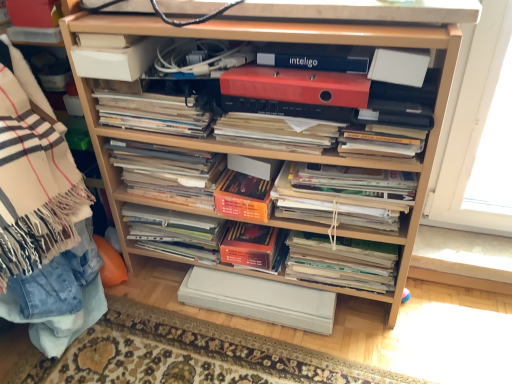
Locate an element on the screen. free region on the left part of blue matte inteligo at upper center, which appears as the second paperback book when viewed from the top is located at coordinates (270, 69).